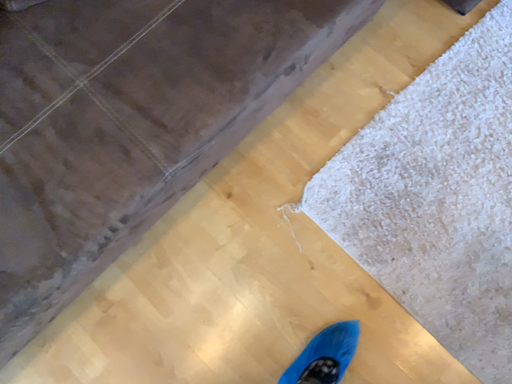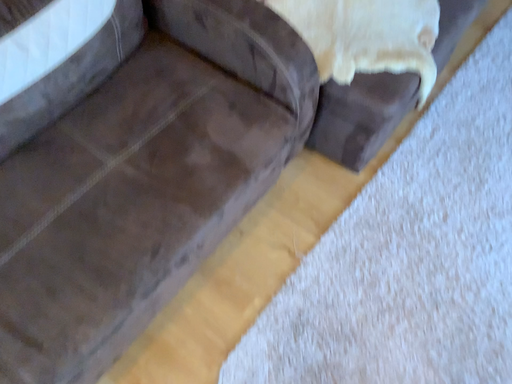
Question: Which way did the camera rotate in the video?

Choices:
 (A) rotated downward
 (B) rotated upward

Answer: (B)